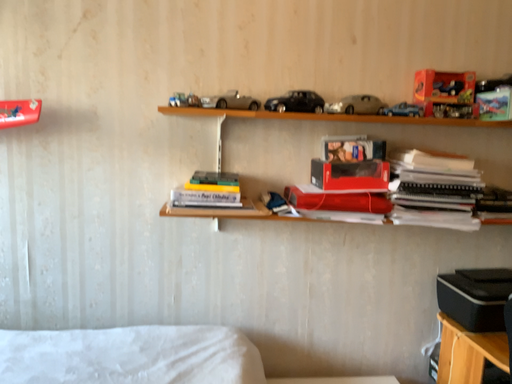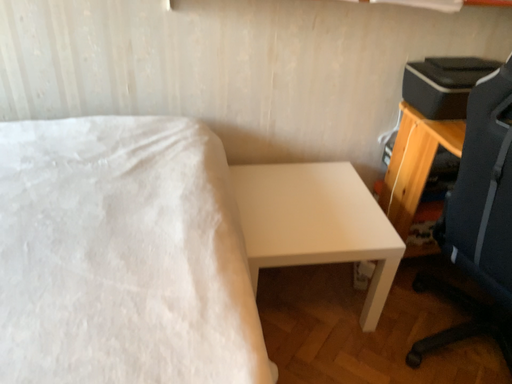
Question: Which way did the camera rotate in the video?

Choices:
 (A) rotated upward
 (B) rotated downward

Answer: (B)